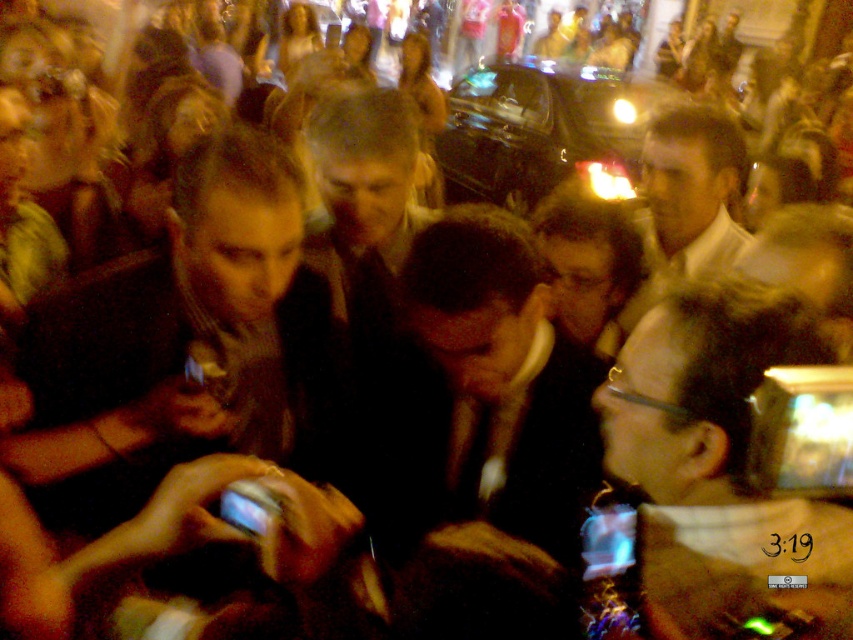
Question: Among these points, which one is nearest to the camera?

Choices:
 (A) (233, 403)
 (B) (805, 580)
 (C) (666, 212)

Answer: (B)

Question: Which object is the farthest from the clear plastic phone at right?

Choices:
 (A) dark brown leather jacket at left
 (B) matte white shirt at center

Answer: (B)

Question: Which object is positioned closest to the clear plastic phone at right?

Choices:
 (A) dark brown leather jacket at left
 (B) matte white shirt at center

Answer: (A)

Question: Can you confirm if dark brown leather jacket at left is positioned above matte white shirt at center?

Choices:
 (A) no
 (B) yes

Answer: (A)

Question: Is dark brown leather jacket at left to the left of matte white shirt at center from the viewer's perspective?

Choices:
 (A) no
 (B) yes

Answer: (B)

Question: In this image, where is dark brown leather jacket at left located relative to matte white shirt at center?

Choices:
 (A) left
 (B) right

Answer: (A)